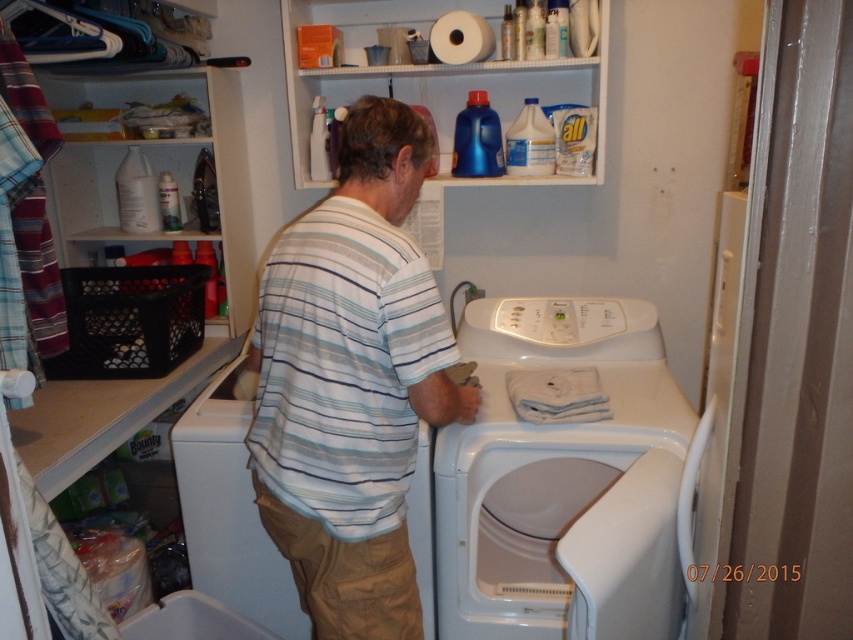
Which is more to the left, black plastic basket at left or white textured paper towel at upper center?

From the viewer's perspective, black plastic basket at left appears more on the left side.

Which of these two, black plastic basket at left or white textured paper towel at upper center, stands shorter?

With less height is white textured paper towel at upper center.

Between point (239, 236) and point (283, 20), which one is positioned in front?

Point (283, 20) is more forward.

What are the coordinates of `black plastic basket at left` in the screenshot? It's located at (219, 154).

Is point (640, 440) farther from camera compared to point (325, 74)?

No, (640, 440) is closer to viewer.

Can you confirm if white glossy washing machine at center is thinner than white textured paper towel at upper center?

Correct, white glossy washing machine at center's width is less than white textured paper towel at upper center's.

The width and height of the screenshot is (853, 640). What do you see at coordinates (561, 481) in the screenshot?
I see `white glossy washing machine at center` at bounding box center [561, 481].

I want to click on white glossy washing machine at center, so click(x=561, y=481).

The height and width of the screenshot is (640, 853). Find the location of `white glossy washing machine at center`. white glossy washing machine at center is located at coordinates (561, 481).

Can you confirm if white glossy washing machine at center is positioned below white matte washing machine at center?

No.

Is point (444, 460) less distant than point (181, 502)?

Yes, point (444, 460) is in front of point (181, 502).

Locate an element on the screen. Image resolution: width=853 pixels, height=640 pixels. white glossy washing machine at center is located at coordinates (561, 481).